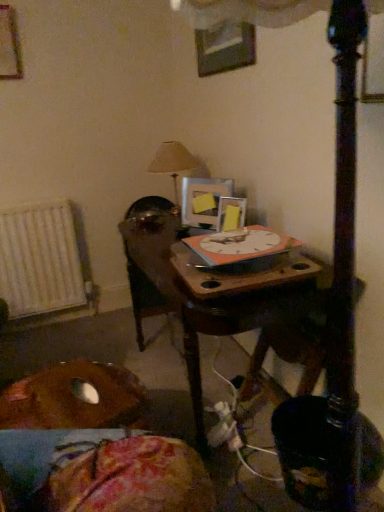
The height and width of the screenshot is (512, 384). I want to click on wooden picture frame at upper left, which ranks as the first picture frame in top-to-bottom order, so click(9, 45).

How much space does matte silver picture frame at center, arranged as the fourth picture frame when viewed from the left, occupy horizontally?

4.13 inches.

What do you see at coordinates (225, 48) in the screenshot?
I see `metallic silver picture frame at upper center, the second picture frame viewed from the right` at bounding box center [225, 48].

Measure the distance between point (x=82, y=419) and camera.

The depth of point (x=82, y=419) is 1.20 meters.

In order to face white metallic radiator at left, should I rotate leftwards or rightwards?

To align with it, rotate left about 19.278°.

Locate an element on the screen. The height and width of the screenshot is (512, 384). beige fabric lampshade at upper center is located at coordinates (173, 163).

The image size is (384, 512). What do you see at coordinates (173, 163) in the screenshot? I see `beige fabric lampshade at upper center` at bounding box center [173, 163].

Locate an element on the screen. The width and height of the screenshot is (384, 512). wooden picture frame at upper left, which ranks as the first picture frame in top-to-bottom order is located at coordinates (9, 45).

Which is closer, (176,150) or (73,268)?

The point (176,150) is more forward.

From a real-world perspective, which object rests below the other?

In real-world perspective, white metallic radiator at left is lower.

Which object is more forward, beige fabric lampshade at upper center or white metallic radiator at left?

beige fabric lampshade at upper center.

Measure the distance from beige fabric lampshade at upper center to white metallic radiator at left.

beige fabric lampshade at upper center and white metallic radiator at left are 35.16 inches apart.

From a real-world perspective, is white metallic radiator at left on top of matte silver picture frame at center, arranged as the fourth picture frame when viewed from the left?

No, from a real-world perspective, white metallic radiator at left is not over matte silver picture frame at center, arranged as the fourth picture frame when viewed from the left

Is point (63, 234) farther from viewer compared to point (231, 197)?

Yes.

Can you tell me how much white metallic radiator at left and matte silver picture frame at center, placed as the 1th picture frame when sorted from bottom to top, differ in facing direction?

The facing directions of white metallic radiator at left and matte silver picture frame at center, placed as the 1th picture frame when sorted from bottom to top, are 65.6 degrees apart.

Can you confirm if white metallic radiator at left is bigger than matte silver picture frame at center, placed as the 1th picture frame when sorted from bottom to top?

Yes, white metallic radiator at left is bigger than matte silver picture frame at center, placed as the 1th picture frame when sorted from bottom to top.

Locate an element on the screen. The width and height of the screenshot is (384, 512). picture frame that is the 3rd one when counting upward from the brown fabric cushion at lower left (from the image's perspective) is located at coordinates (225, 48).

Between brown fabric cushion at lower left and metallic silver picture frame at upper center, the 3th picture frame when ordered from left to right, which one has larger width?

With larger width is brown fabric cushion at lower left.

From the image's perspective, which object appears higher, brown fabric cushion at lower left or metallic silver picture frame at upper center, the second picture frame viewed from the right?

metallic silver picture frame at upper center, the second picture frame viewed from the right.

Can you confirm if brown fabric cushion at lower left is taller than metallic silver picture frame at upper center, the 3th picture frame when ordered from left to right?

Incorrect, the height of brown fabric cushion at lower left is not larger of that of metallic silver picture frame at upper center, the 3th picture frame when ordered from left to right.

Does point (18, 252) lie behind point (249, 52)?

Yes, it is.

Considering the sizes of white metallic radiator at left and metallic silver picture frame at upper center, which is counted as the third picture frame, starting from the bottom, in the image, is white metallic radiator at left bigger or smaller than metallic silver picture frame at upper center, which is counted as the third picture frame, starting from the bottom,?

In the image, white metallic radiator at left appears to be larger than metallic silver picture frame at upper center, which is counted as the third picture frame, starting from the bottom.

Does white metallic radiator at left turn towards metallic silver picture frame at upper center, the 3th picture frame when ordered from left to right?

No.

You are a GUI agent. You are given a task and a screenshot of the screen. Output one action in this format:
    pyautogui.click(x=<x>, y=<y>)
    Task: Click on the radiator located underneath the metallic silver picture frame at upper center, which is counted as the third picture frame, starting from the bottom (from a real-world perspective)
    The width and height of the screenshot is (384, 512).
    Given the screenshot: What is the action you would take?
    pyautogui.click(x=43, y=261)

Considering the sizes of objects beige fabric lampshade at upper center and wooden picture frame at upper left, the 4th picture frame from the right, in the image provided, who is taller, beige fabric lampshade at upper center or wooden picture frame at upper left, the 4th picture frame from the right,?

Standing taller between the two is beige fabric lampshade at upper center.

In the image, is beige fabric lampshade at upper center positioned in front of or behind wooden picture frame at upper left, which ranks as the first picture frame in top-to-bottom order?

beige fabric lampshade at upper center is positioned farther from the viewer than wooden picture frame at upper left, which ranks as the first picture frame in top-to-bottom order.

Who is smaller, beige fabric lampshade at upper center or wooden picture frame at upper left, which ranks as the first picture frame in top-to-bottom order?

Smaller between the two is wooden picture frame at upper left, which ranks as the first picture frame in top-to-bottom order.

Is matte silver picture frame at center, the 1th picture frame viewed from the right, facing away from metallic silver picture frame at upper center, the second picture frame viewed from the right?

No.

Based on the photo, considering the positions of objects matte silver picture frame at center, the 1th picture frame viewed from the right, and metallic silver picture frame at upper center, the second picture frame viewed from the right, in the image provided, who is more to the right, matte silver picture frame at center, the 1th picture frame viewed from the right, or metallic silver picture frame at upper center, the second picture frame viewed from the right,?

matte silver picture frame at center, the 1th picture frame viewed from the right.

Locate an element on the screen. This screenshot has width=384, height=512. picture frame in front of the matte silver picture frame at center, placed as the 1th picture frame when sorted from bottom to top is located at coordinates (225, 48).

How different are the orientations of matte silver picture frame at center, arranged as the fourth picture frame when viewed from the left, and metallic silver picture frame at upper center, the 3th picture frame when ordered from left to right, in degrees?

24.4 degrees.

Is brown fabric cushion at lower left at the left side of white metallic radiator at left?

No, brown fabric cushion at lower left is not to the left of white metallic radiator at left.

Can you confirm if brown fabric cushion at lower left is shorter than white metallic radiator at left?

Indeed, brown fabric cushion at lower left has a lesser height compared to white metallic radiator at left.

From a real-world perspective, which is physically below, brown fabric cushion at lower left or white metallic radiator at left?

brown fabric cushion at lower left, from a real-world perspective.

The image size is (384, 512). I want to click on table lamp located in front of the white metallic radiator at left, so click(x=173, y=163).

Find the location of a particular element. The image size is (384, 512). radiator that appears on the left of matte silver picture frame at center, the 4th picture frame in the top-to-bottom sequence is located at coordinates (43, 261).

Which object lies nearer to the anchor point matte silver picture frame at center, the 1th picture frame viewed from the right, brown fabric cushion at lower left or wooden picture frame at upper left, marked as the 4th picture frame in a bottom-to-top arrangement?

brown fabric cushion at lower left.

Based on their spatial positions, is wooden picture frame at upper left, which ranks as the first picture frame in top-to-bottom order, or beige fabric lampshade at upper center closer to metallic silver picture frame at upper center, the second picture frame viewed from the right?

beige fabric lampshade at upper center lies closer to metallic silver picture frame at upper center, the second picture frame viewed from the right, than the other object.

Considering their positions, is wooden picture frame at upper left, which ranks as the first picture frame in top-to-bottom order, positioned further to beige fabric lampshade at upper center than matte silver picture frame at center, the 4th picture frame in the top-to-bottom sequence?

wooden picture frame at upper left, which ranks as the first picture frame in top-to-bottom order, lies further to beige fabric lampshade at upper center than the other object.

Looking at the image, which one is located further to matte silver picture frame at center, placed as the 1th picture frame when sorted from bottom to top, yellow matte picture frame at upper center, which is the 2th picture frame in left-to-right order, or beige fabric lampshade at upper center?

beige fabric lampshade at upper center is positioned further to the anchor matte silver picture frame at center, placed as the 1th picture frame when sorted from bottom to top.

Which object lies nearer to the anchor point metallic silver picture frame at upper center, the 3th picture frame when ordered from left to right, white metallic radiator at left or matte silver picture frame at center, arranged as the fourth picture frame when viewed from the left?

matte silver picture frame at center, arranged as the fourth picture frame when viewed from the left.

Considering their positions, is yellow matte picture frame at upper center, marked as the second picture frame in a bottom-to-top arrangement, positioned further to beige fabric lampshade at upper center than wooden picture frame at upper left, which ranks as the first picture frame in top-to-bottom order?

The object further to beige fabric lampshade at upper center is wooden picture frame at upper left, which ranks as the first picture frame in top-to-bottom order.

From the image, which object appears to be farther from metallic silver picture frame at upper center, the second picture frame viewed from the right, wooden picture frame at upper left, marked as the 4th picture frame in a bottom-to-top arrangement, or brown fabric cushion at lower left?

brown fabric cushion at lower left.

Considering their positions, is wooden picture frame at upper left, the 4th picture frame from the right, positioned further to metallic silver picture frame at upper center, the 3th picture frame when ordered from left to right, than yellow matte picture frame at upper center, placed as the third picture frame when sorted from right to left?

wooden picture frame at upper left, the 4th picture frame from the right, is positioned further to the anchor metallic silver picture frame at upper center, the 3th picture frame when ordered from left to right.

The image size is (384, 512). Find the location of `table lamp between wooden picture frame at upper left, marked as the 4th picture frame in a bottom-to-top arrangement, and yellow matte picture frame at upper center, marked as the second picture frame in a bottom-to-top arrangement`. table lamp between wooden picture frame at upper left, marked as the 4th picture frame in a bottom-to-top arrangement, and yellow matte picture frame at upper center, marked as the second picture frame in a bottom-to-top arrangement is located at coordinates (173, 163).

You are a GUI agent. You are given a task and a screenshot of the screen. Output one action in this format:
    pyautogui.click(x=<x>, y=<y>)
    Task: Click on the table lamp between brown fabric cushion at lower left and white metallic radiator at left along the z-axis
    
    Given the screenshot: What is the action you would take?
    pyautogui.click(x=173, y=163)

Locate an element on the screen. This screenshot has height=512, width=384. table lamp between metallic silver picture frame at upper center, the 2th picture frame when ordered from top to bottom, and yellow matte picture frame at upper center, which appears as the third picture frame when viewed from the top, from top to bottom is located at coordinates (173, 163).

This screenshot has width=384, height=512. In order to click on table lamp situated between white metallic radiator at left and yellow matte picture frame at upper center, which appears as the third picture frame when viewed from the top, from left to right in this screenshot , I will do `click(173, 163)`.